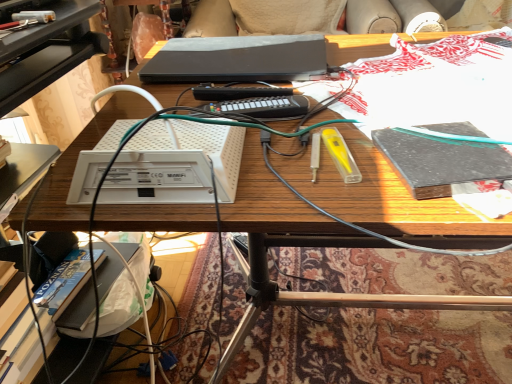
Question: Is black matte book at right facing away from white plastic router at center?

Choices:
 (A) yes
 (B) no

Answer: (B)

Question: Is black matte book at right thinner than white plastic router at center?

Choices:
 (A) no
 (B) yes

Answer: (B)

Question: From a real-world perspective, is black matte book at right beneath white plastic router at center?

Choices:
 (A) no
 (B) yes

Answer: (B)

Question: Does black matte book at right have a greater height compared to white plastic router at center?

Choices:
 (A) yes
 (B) no

Answer: (B)

Question: Considering the relative sizes of black matte book at right and white plastic router at center in the image provided, is black matte book at right smaller than white plastic router at center?

Choices:
 (A) yes
 (B) no

Answer: (A)

Question: In terms of height, does black matte laptop at center look taller or shorter compared to black matte book at right?

Choices:
 (A) tall
 (B) short

Answer: (B)

Question: Looking at the image, does black matte laptop at center seem bigger or smaller compared to black matte book at right?

Choices:
 (A) big
 (B) small

Answer: (A)

Question: Considering the positions of black matte laptop at center and black matte book at right in the image, is black matte laptop at center wider or thinner than black matte book at right?

Choices:
 (A) wide
 (B) thin

Answer: (A)

Question: From a real-world perspective, is black matte laptop at center positioned above or below black matte book at right?

Choices:
 (A) above
 (B) below

Answer: (A)

Question: From a real-world perspective, is white plastic router at center positioned above or below black matte laptop at center?

Choices:
 (A) above
 (B) below

Answer: (A)

Question: From the image's perspective, is white plastic router at center above or below black matte laptop at center?

Choices:
 (A) above
 (B) below

Answer: (B)

Question: Considering their positions, is white plastic router at center located in front of or behind black matte laptop at center?

Choices:
 (A) behind
 (B) front

Answer: (B)

Question: From their relative heights in the image, would you say white plastic router at center is taller or shorter than black matte laptop at center?

Choices:
 (A) tall
 (B) short

Answer: (A)

Question: From a real-world perspective, is black matte book at right physically located above or below white plastic router at center?

Choices:
 (A) below
 (B) above

Answer: (A)

Question: Relative to white plastic router at center, is black matte book at right in front or behind?

Choices:
 (A) front
 (B) behind

Answer: (B)